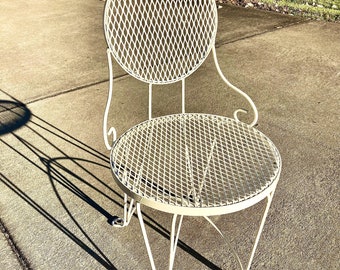
Image resolution: width=340 pixels, height=270 pixels. What are the coordinates of `white edge of the metal chair seat` in the screenshot? It's located at (269, 188).